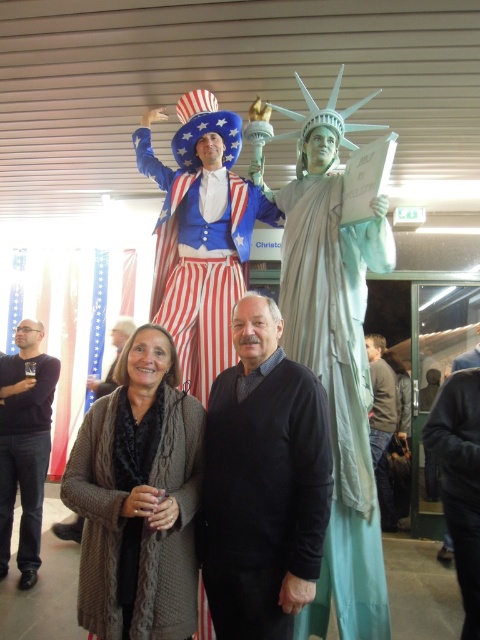
You are a photographer standing at the back of the event. You need to take a photo of the black velvet sweater at center and the dark gray sweater at center. The camera has a maximum focus range of 5 feet. Can you capture both subjects clearly in one shot without moving the camera?

The black velvet sweater at center is 6.71 feet from the dark gray sweater at center, which exceeds the camera maximum focus range of 5 feet. Therefore, you cannot capture both subjects clearly in one shot without moving the camera.

You are planning to take a photo of the light blue fabric statue at center and the black velvet sweater at center. Which one should you focus on if you want to capture the larger object in your shot?

The light blue fabric statue at center is bigger than the black velvet sweater at center, so you should focus on the light blue fabric statue at center to capture the larger object in your shot.

You are standing in the room and want to place a new decoration exactly at the center of the room. The light blue fabric statue at center is currently at point 0.548, 0.694. Is the statue already placed at the center?

The light blue fabric statue at center is located at point (333, 349), so it is already placed at the center of the room.